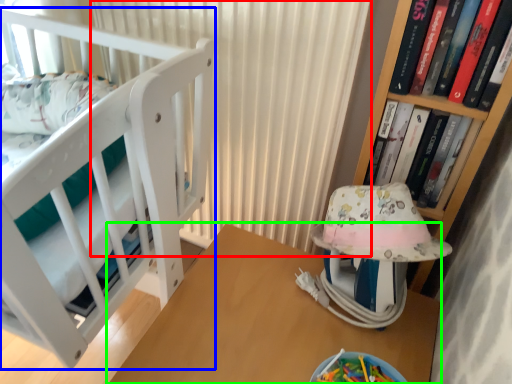
Question: Estimate the real-world distances between objects in this image. Which object is closer to curtain (highlighted by a red box), furniture (highlighted by a blue box) or table (highlighted by a green box)?

Choices:
 (A) furniture
 (B) table

Answer: (A)